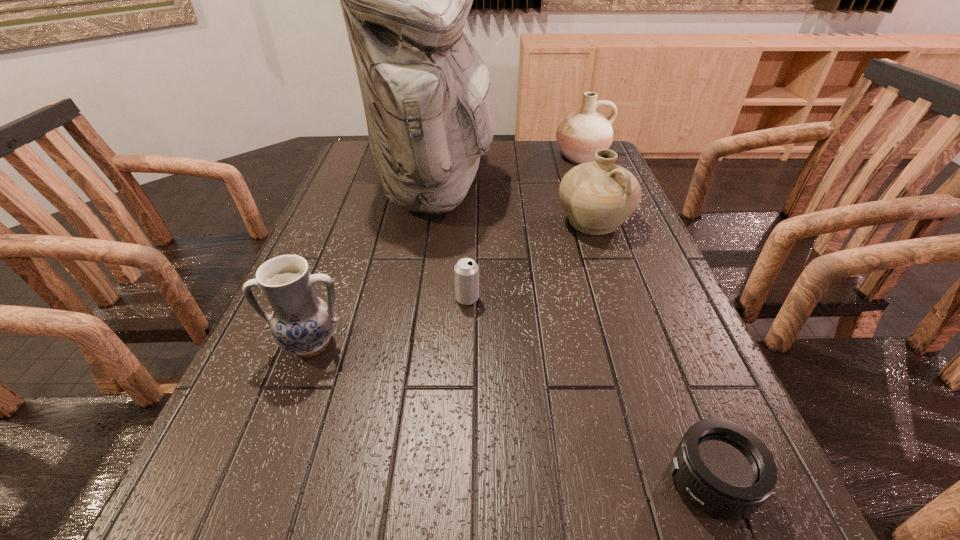
Identify the location of unoccupied position between the fourth farthest object and the leftmost pottery. (389, 321).

Where is `empty space that is in between the second nearest pottery and the tallest object`? empty space that is in between the second nearest pottery and the tallest object is located at coordinates 516,206.

In order to click on vacant region between the second nearest pottery and the backpack in this screenshot , I will do `click(516, 206)`.

This screenshot has width=960, height=540. I want to click on free space that is in between the second farthest pottery and the nearest pottery, so click(452, 283).

You are a GUI agent. You are given a task and a screenshot of the screen. Output one action in this format:
    pyautogui.click(x=<x>, y=<y>)
    Task: Click on the vacant space in between the tallest object and the beer can
    The width and height of the screenshot is (960, 540).
    Given the screenshot: What is the action you would take?
    pyautogui.click(x=452, y=244)

I want to click on vacant space that's between the leftmost pottery and the third nearest object, so click(389, 321).

Identify the location of free spot between the tallest object and the nearest pottery. (374, 267).

Image resolution: width=960 pixels, height=540 pixels. I want to click on vacant space that's between the second farthest pottery and the nearest pottery, so click(452, 283).

Locate an element on the screen. This screenshot has height=540, width=960. blank region between the leftmost pottery and the shortest object is located at coordinates (511, 413).

Identify the location of empty location between the leftmost pottery and the farthest pottery. This screenshot has height=540, width=960. point(446,250).